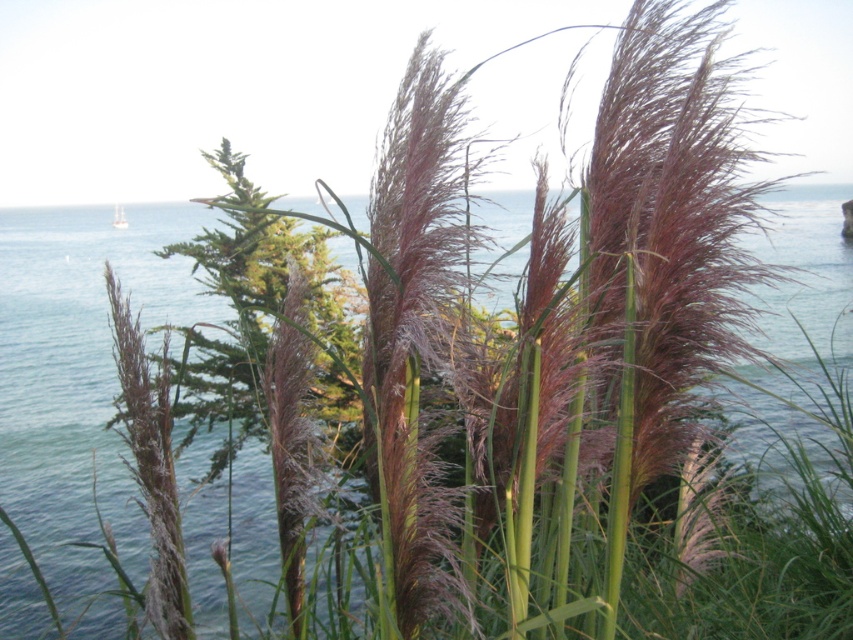
You are standing on the beach and see the blue water at center and the white wooden boat at center. Which object is positioned to the right side?

The blue water at center is to the right of the white wooden boat at center, so the blue water at center is positioned to the right side.

You are standing in a coastal area with tall plants in front of you. You notice two points marked on the ground at coordinates point (164, 220) and point (119, 214). Which point is closer to your current position?

Point (164, 220) is further to the viewer than point (119, 214), so the point closer to your current position is point (119, 214).